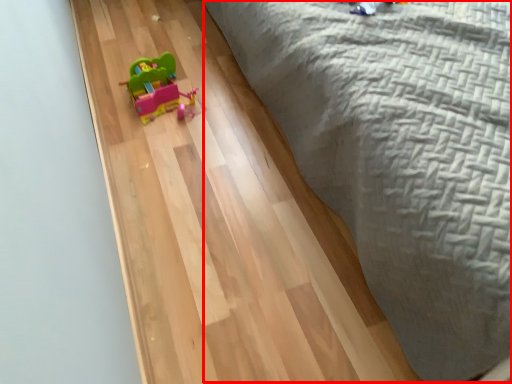
Question: From the image's perspective, where is bed (annotated by the red box) located relative to toy?

Choices:
 (A) above
 (B) below

Answer: (A)